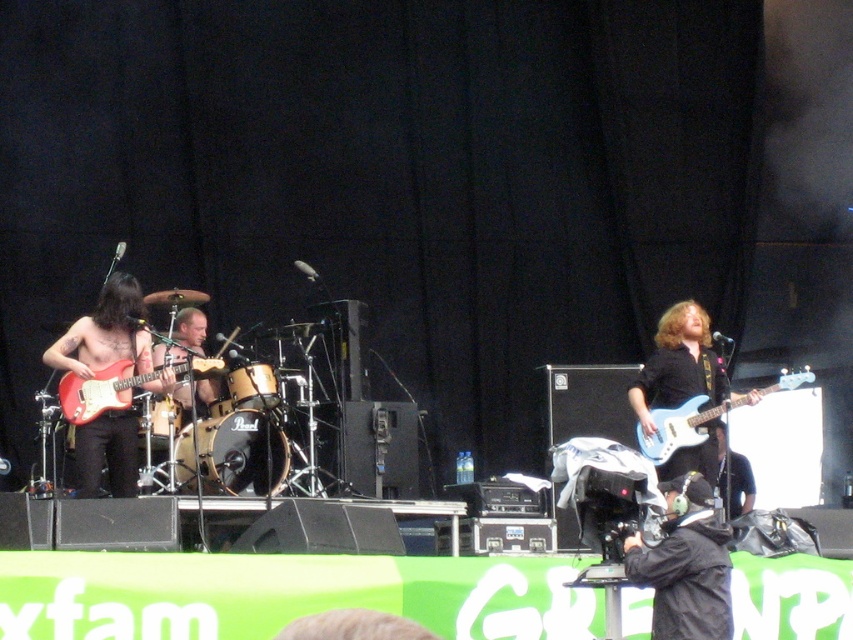
Question: Is matte black guitar at left above matte red electric guitar at left?

Choices:
 (A) no
 (B) yes

Answer: (B)

Question: Can you confirm if matte red electric guitar at left is positioned below matte blue electric guitar at right?

Choices:
 (A) yes
 (B) no

Answer: (B)

Question: Is matte black guitar at left to the right of blue glossy electric guitar at center from the viewer's perspective?

Choices:
 (A) no
 (B) yes

Answer: (A)

Question: Which point appears closest to the camera in this image?

Choices:
 (A) (764, 388)
 (B) (96, 376)

Answer: (B)

Question: Which of the following is the farthest from the observer?

Choices:
 (A) matte blue electric guitar at right
 (B) matte red electric guitar at left

Answer: (A)

Question: Which object is the closest to the matte red electric guitar at left?

Choices:
 (A) matte blue electric guitar at right
 (B) blue glossy electric guitar at center
 (C) matte black guitar at left

Answer: (C)